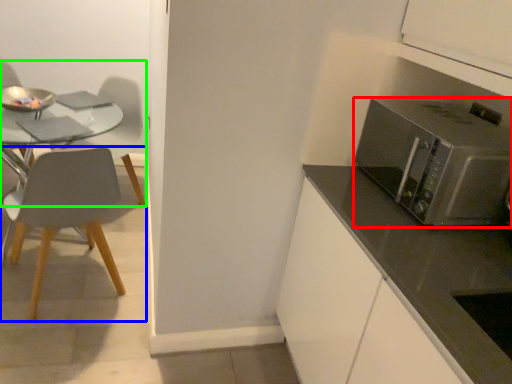
Question: Considering the real-world distances, which object is closest to microwave oven (highlighted by a red box)? chair (highlighted by a blue box) or chair (highlighted by a green box).

Choices:
 (A) chair
 (B) chair

Answer: (A)